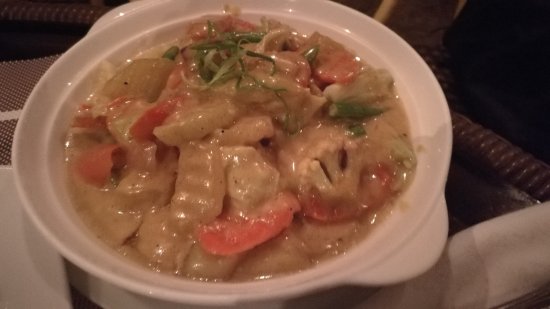
Where is `far left edge of bowl`? far left edge of bowl is located at coordinates (12, 180).